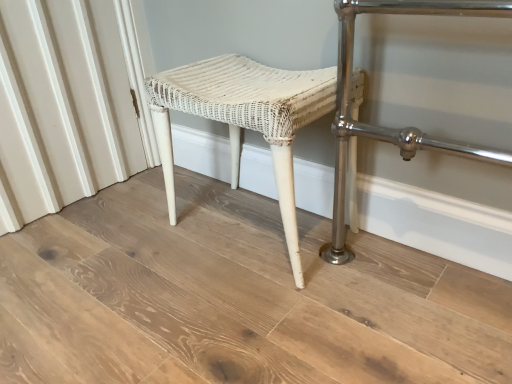
In order to click on free space in front of white wicker stool at center in this screenshot , I will do `click(263, 312)`.